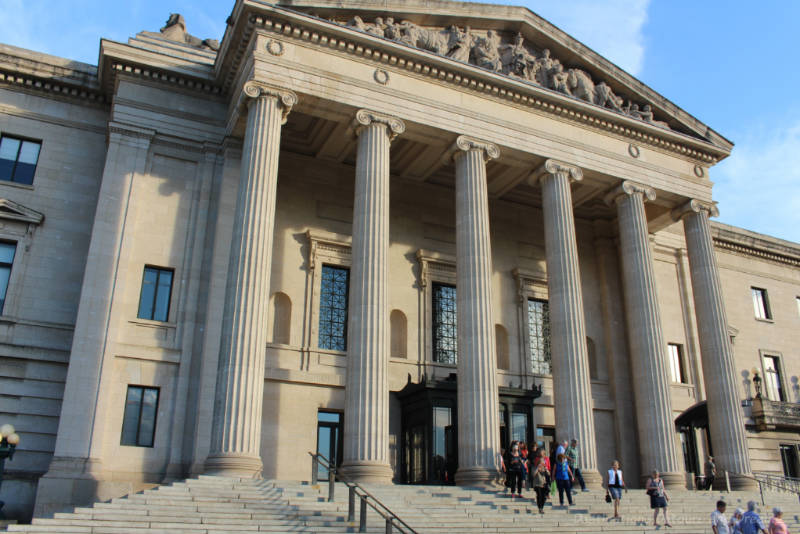
Image resolution: width=800 pixels, height=534 pixels. Find the location of `stairs`. stairs is located at coordinates (460, 508).